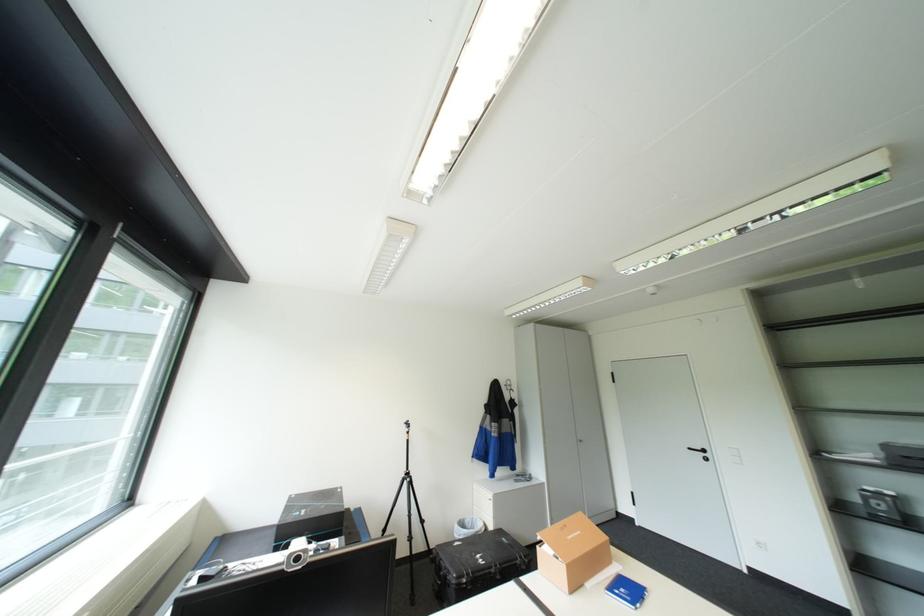
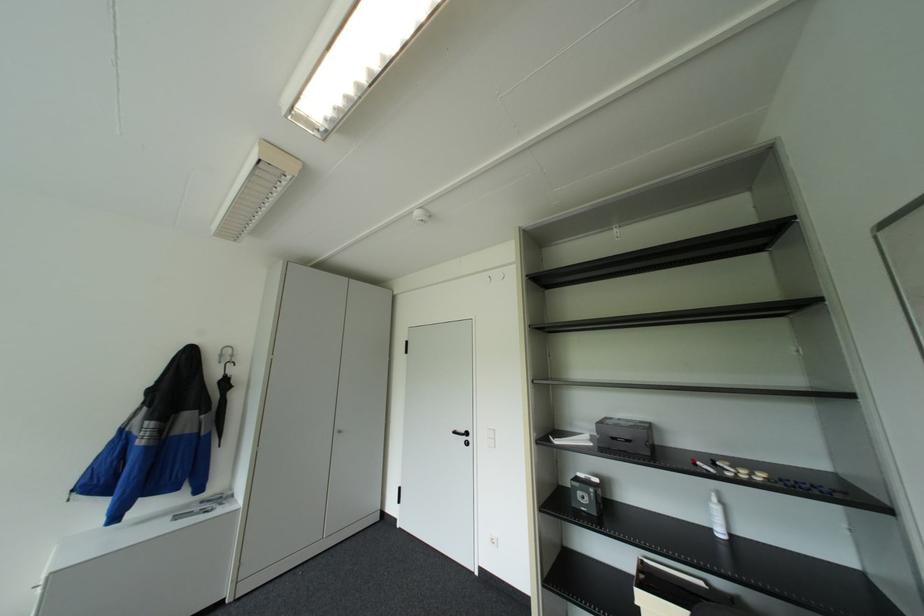
Locate, in the second image, the point that corresponds to the point at 886,460 in the first image.

(600, 443)